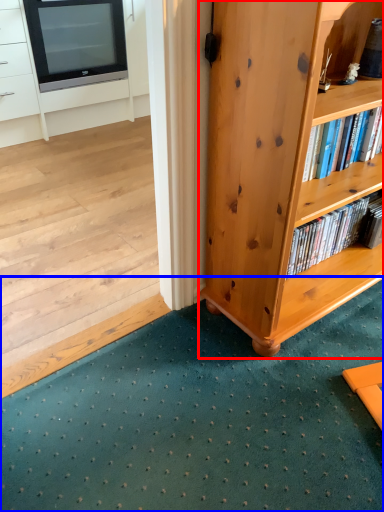
Question: Which object is further to the camera taking this photo, bookcase (highlighted by a red box) or doormat (highlighted by a blue box)?

Choices:
 (A) bookcase
 (B) doormat

Answer: (A)